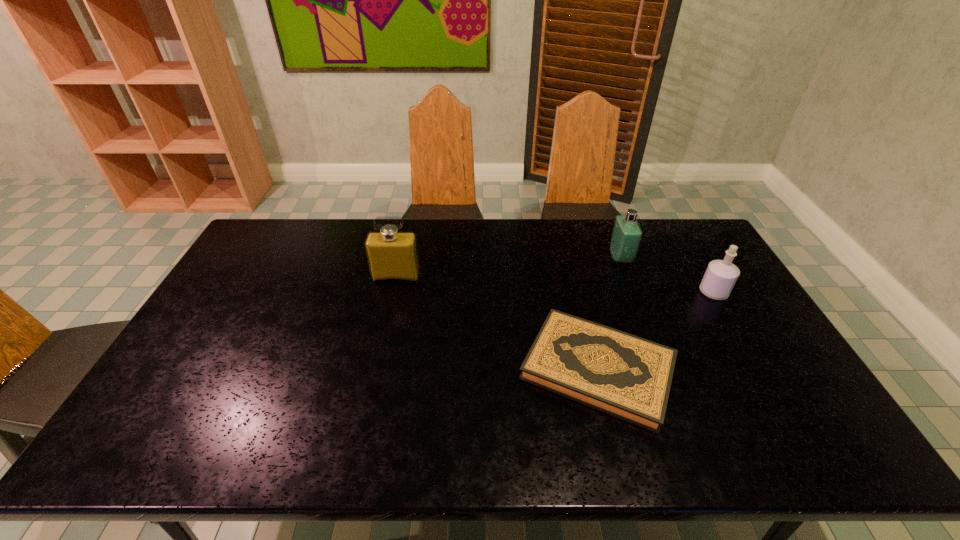
You are a GUI agent. You are given a task and a screenshot of the screen. Output one action in this format:
    pyautogui.click(x=<x>, y=<y>)
    Task: Click on the vacant area between the rightmost perfume and the shortest object
    This screenshot has height=540, width=960.
    Given the screenshot: What is the action you would take?
    pyautogui.click(x=656, y=330)

The image size is (960, 540). I want to click on unoccupied position between the rightmost perfume and the leftmost object, so click(555, 285).

Locate an element on the screen. The image size is (960, 540). free space between the hardback book and the second perfume from left to right is located at coordinates (609, 314).

Locate an element on the screen. This screenshot has width=960, height=540. free area in between the leftmost perfume and the shortest object is located at coordinates (497, 323).

At what (x,y) coordinates should I click in order to perform the action: click on empty location between the nearest object and the second perfume from left to right. Please return your answer as a coordinate pair (x, y). Looking at the image, I should click on (609, 314).

Where is `unoccupied position between the leftmost perfume and the hardback book`? unoccupied position between the leftmost perfume and the hardback book is located at coordinates click(497, 323).

I want to click on unoccupied area between the hardback book and the leftmost object, so click(x=497, y=323).

I want to click on vacant space that's between the shortest object and the farthest object, so click(609, 314).

This screenshot has width=960, height=540. I want to click on vacant space that's between the shortest object and the leftmost perfume, so click(x=497, y=323).

Where is `object that ranks as the third closest to the second perfume from left to right`? The width and height of the screenshot is (960, 540). object that ranks as the third closest to the second perfume from left to right is located at coordinates point(392,255).